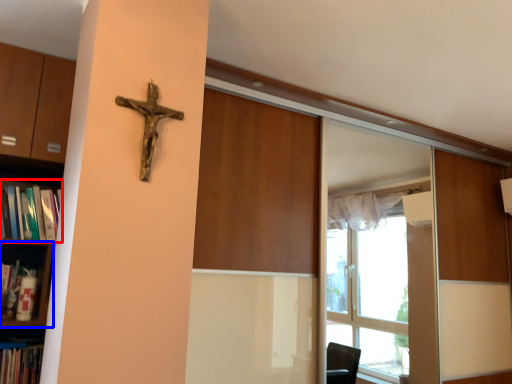
Question: Among these objects, which one is farthest to the camera, book (highlighted by a red box) or shelf (highlighted by a blue box)?

Choices:
 (A) book
 (B) shelf

Answer: (B)